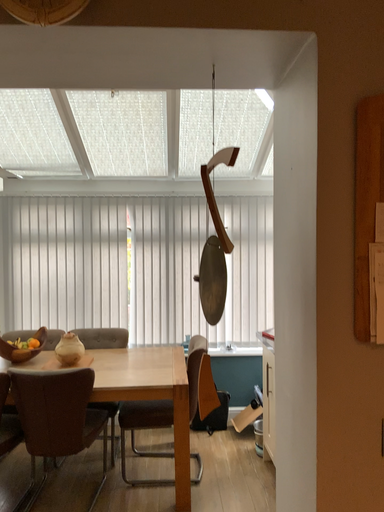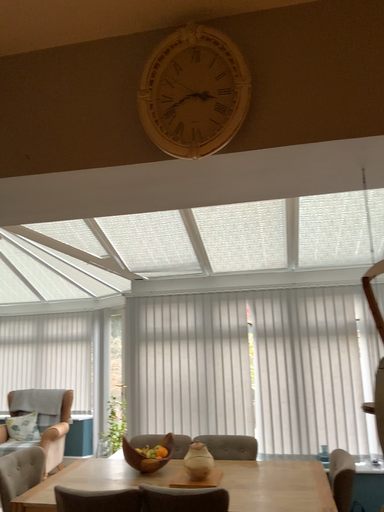
Question: Which way did the camera rotate in the video?

Choices:
 (A) rotated left
 (B) rotated right

Answer: (A)